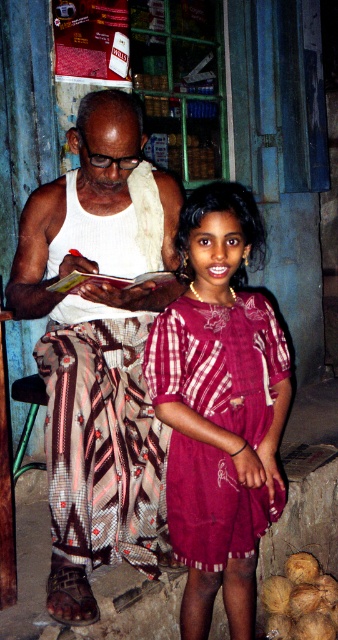
Between white textured tank top at center and maroon woven dress at center, which one has more height?

white textured tank top at center

Is point (52, 332) farther from camera compared to point (189, 444)?

Yes, point (52, 332) is behind point (189, 444).

Image resolution: width=338 pixels, height=640 pixels. Find the location of `white textured tank top at center`. white textured tank top at center is located at coordinates point(99,348).

Does white textured tank top at center have a lesser width compared to brown rough coconut at lower right?

No.

Which is in front, point (164, 292) or point (296, 579)?

Point (164, 292) is more forward.

I want to click on white textured tank top at center, so click(99, 348).

Where is `white textured tank top at center`? This screenshot has width=338, height=640. white textured tank top at center is located at coordinates (99, 348).

How much distance is there between maroon woven dress at center and brown rough coconut at lower right?

They are 38.77 inches apart.

Between maroon woven dress at center and brown rough coconut at lower right, which one is positioned higher?

maroon woven dress at center is above.

Does point (238, 528) come in front of point (304, 563)?

Yes, it is.

At what (x,y) coordinates should I click in order to perform the action: click on maroon woven dress at center. Please return your answer as a coordinate pair (x, y). Looking at the image, I should click on pos(220,410).